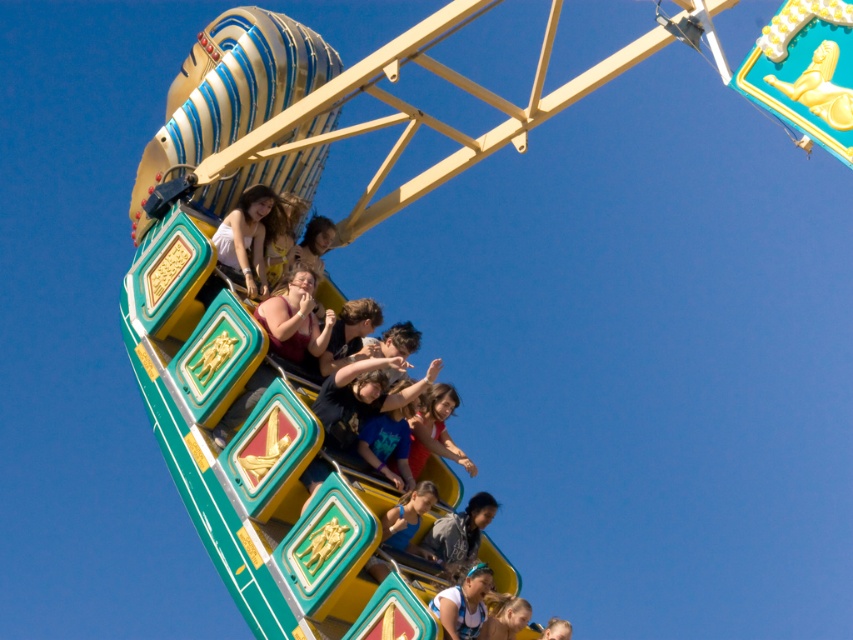
Looking at this image, you are standing at the base of the Ferris wheel and see the matte maroon shirt at center and the matte blue hair at lower center. Which object is closer to you?

The matte blue hair at lower center is closer to you since it is at lower center compared to the matte maroon shirt at center which is farther away.

Consider the image. You are standing at the center of the Ferris wheel ride and looking around. You notice a gray fabric shirt at center. Can you tell me what is located exactly at the point with coordinates (459, 534)?

The gray fabric shirt at center is located exactly at the point with coordinates (459, 534).

You are standing at the base of the Ferris wheel and notice two points marked on the Ferris wheel structure. The first point is at coordinates point (294, 273) and the second is at point (517, 621). If you were to look directly at the Ferris wheel, which point would appear closer to you?

Point (517, 621) would appear closer to you because point (294, 273) is behind it.